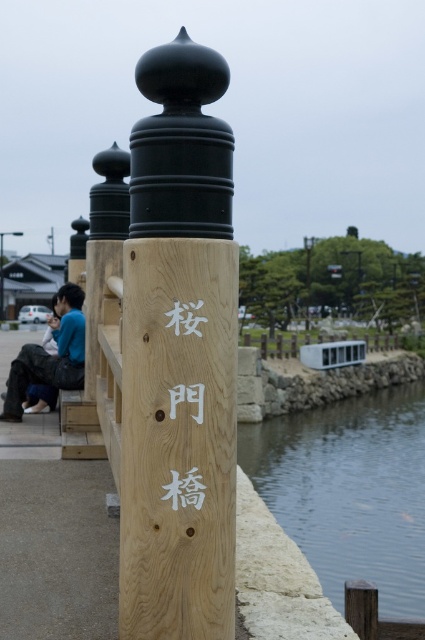
Question: In this image, where is blue cotton shirt at left located relative to white wood sign at center?

Choices:
 (A) left
 (B) right

Answer: (A)

Question: Which object is farther from the camera taking this photo?

Choices:
 (A) blue cotton shirt at left
 (B) white wood sign at center
 (C) natural wood signpost at center

Answer: (A)

Question: Considering the real-world distances, which object is closest to the natural wood signpost at center?

Choices:
 (A) white wood sign at center
 (B) blue cotton shirt at left

Answer: (A)

Question: Among these points, which one is nearest to the camera?

Choices:
 (A) (198, 486)
 (B) (385, 412)
 (C) (181, 332)

Answer: (A)

Question: Is blue cotton shirt at left smaller than white wood sign at center?

Choices:
 (A) no
 (B) yes

Answer: (A)

Question: Can you confirm if clear water at lower right is bigger than blue cotton shirt at left?

Choices:
 (A) yes
 (B) no

Answer: (A)